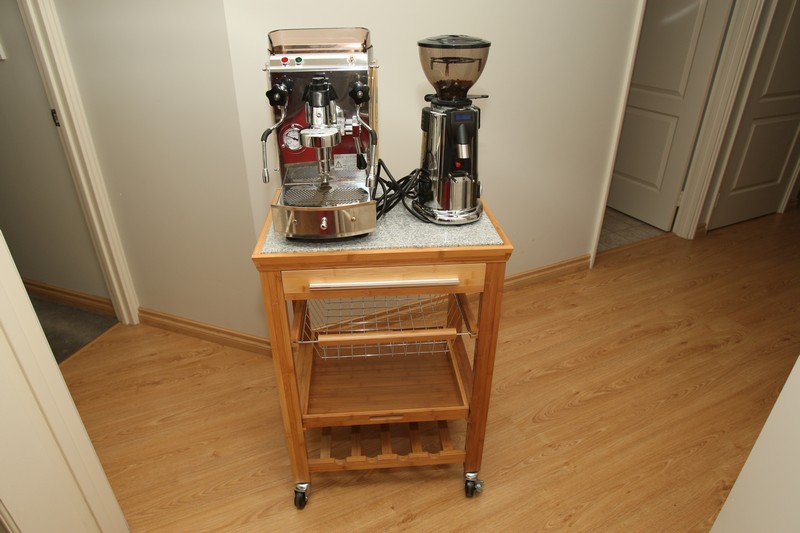
I want to click on tray, so click(397, 407).